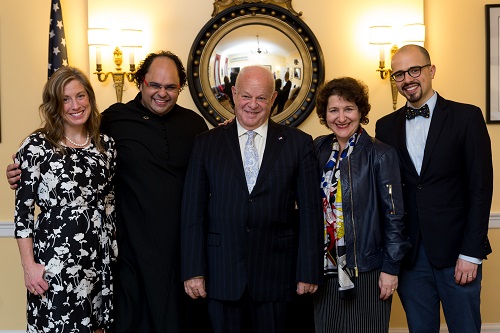
Image resolution: width=500 pixels, height=333 pixels. Identify the location of reflective surface. click(255, 52).